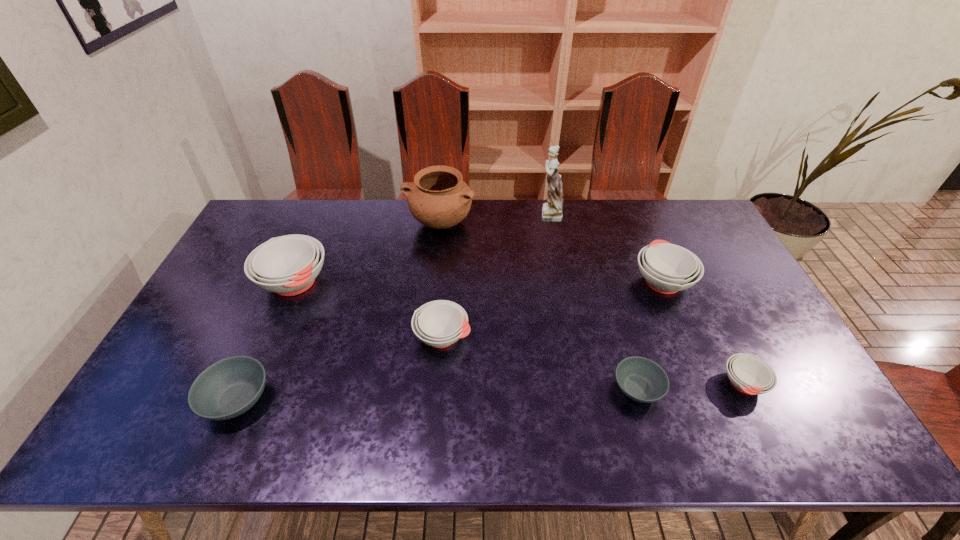
You are a GUI agent. You are given a task and a screenshot of the screen. Output one action in this format:
    pyautogui.click(x=<x>, y=<y>)
    Task: Click on the vacant space at the near edge of the desktop
    
    Given the screenshot: What is the action you would take?
    pyautogui.click(x=369, y=451)

Locate an element on the screen. The width and height of the screenshot is (960, 540). vacant region at the left edge of the desktop is located at coordinates (228, 333).

Where is `vacant region at the right edge of the desktop`? The width and height of the screenshot is (960, 540). vacant region at the right edge of the desktop is located at coordinates (710, 284).

Where is `free space at the far left corner of the desktop`? free space at the far left corner of the desktop is located at coordinates (288, 227).

Identify the location of vacant space in between the pottery and the tallest object. The width and height of the screenshot is (960, 540). (494, 219).

Where is `vacant point located between the fifth shortest soup bowl and the second smallest white soup bowl`? vacant point located between the fifth shortest soup bowl and the second smallest white soup bowl is located at coordinates point(552,308).

Where is `free spot between the shortest object and the fourth soup bowl from right to left`? This screenshot has width=960, height=540. free spot between the shortest object and the fourth soup bowl from right to left is located at coordinates (540, 362).

At what (x,y) coordinates should I click in order to perform the action: click on free spot between the second tallest soup bowl and the sixth object from left to right. Please return your answer as a coordinate pair (x, y). Looking at the image, I should click on (650, 335).

You are a GUI agent. You are given a task and a screenshot of the screen. Output one action in this format:
    pyautogui.click(x=<x>, y=<y>)
    Task: Click on the vacant space that is in between the third white soup bowl from right to left and the third tallest object
    The image size is (960, 540).
    Given the screenshot: What is the action you would take?
    pyautogui.click(x=369, y=309)

The height and width of the screenshot is (540, 960). I want to click on free space between the tallest object and the smaller gray soup bowl, so click(593, 301).